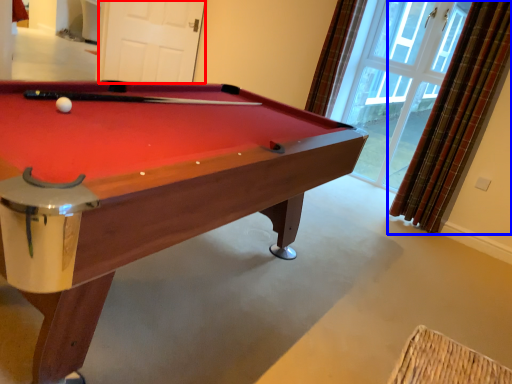
Question: Which point is further to the camera, screen door (highlighted by a red box) or curtain (highlighted by a blue box)?

Choices:
 (A) screen door
 (B) curtain

Answer: (A)